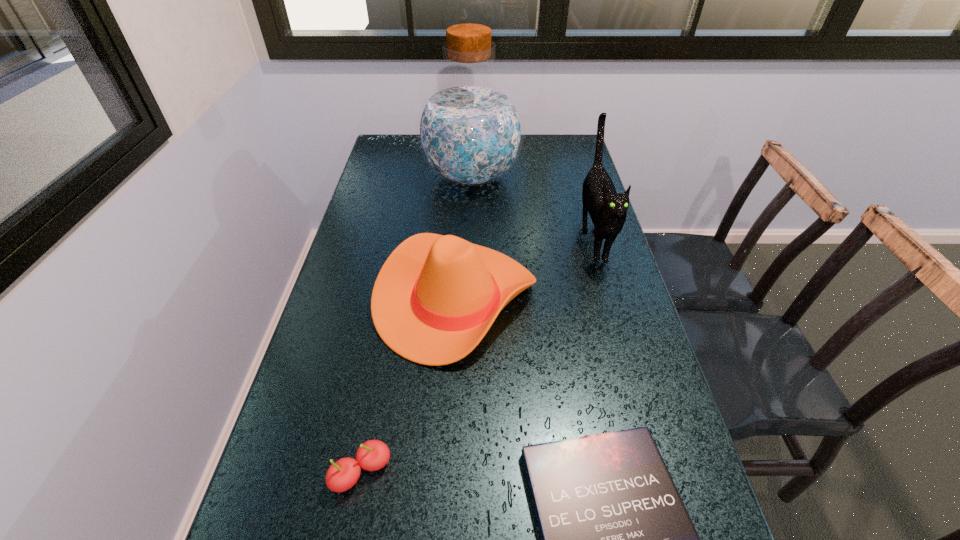
Find the location of a particular element. cowboy hat that is at the left edge is located at coordinates (435, 298).

The height and width of the screenshot is (540, 960). In order to click on cherry positioned at the left edge in this screenshot , I will do `click(372, 455)`.

Identify the location of object present at the right edge. (607, 209).

The height and width of the screenshot is (540, 960). In order to click on vacant space at the left edge in this screenshot , I will do `click(321, 522)`.

This screenshot has width=960, height=540. Find the location of `vacant space at the right edge of the desktop`. vacant space at the right edge of the desktop is located at coordinates tap(608, 315).

In the image, there is a desktop. Where is `free space at the far left corner`? free space at the far left corner is located at coordinates (396, 163).

The width and height of the screenshot is (960, 540). I want to click on free space at the far right corner, so click(553, 157).

Find the location of `vacant area that lies between the second shortest object and the cat`. vacant area that lies between the second shortest object and the cat is located at coordinates (477, 356).

The image size is (960, 540). Identify the location of vacant area between the cherry and the second tallest object. (477, 356).

Image resolution: width=960 pixels, height=540 pixels. I want to click on free space between the water jug and the third tallest object, so click(x=464, y=238).